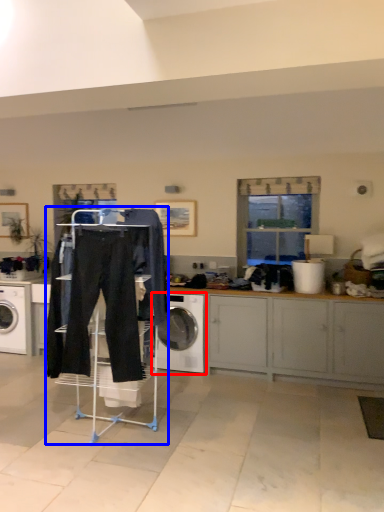
Question: Among these objects, which one is nearest to the camera, washing machine (highlighted by a red box) or closet (highlighted by a blue box)?

Choices:
 (A) washing machine
 (B) closet

Answer: (B)